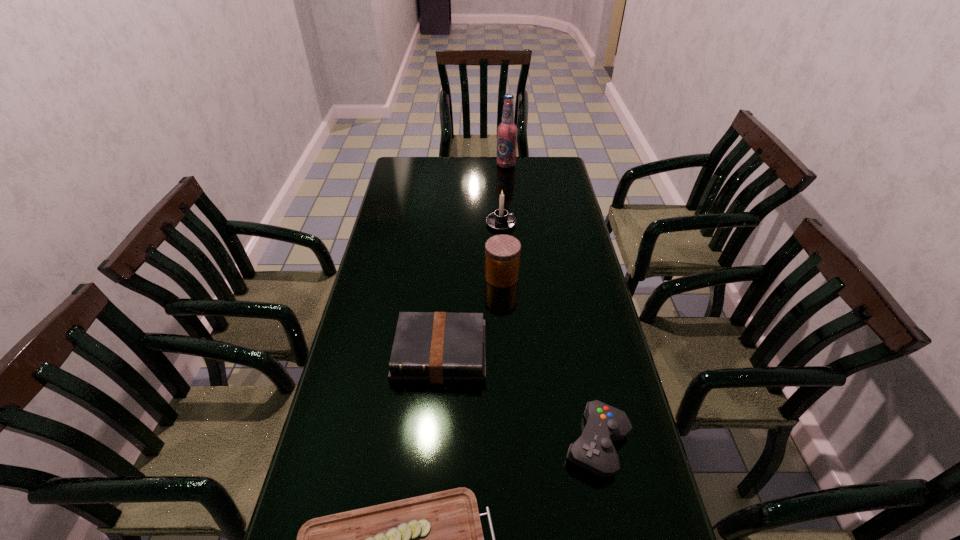
Locate an element on the screen. This screenshot has width=960, height=540. free space between the farthest object and the fourth farthest object is located at coordinates (473, 259).

Where is `free point between the second nearest object and the fourth farthest object`? This screenshot has height=540, width=960. free point between the second nearest object and the fourth farthest object is located at coordinates (518, 399).

Locate an element on the screen. vacant space that is in between the third nearest object and the control is located at coordinates (518, 399).

Locate an element on the screen. The height and width of the screenshot is (540, 960). free spot between the second farthest object and the second nearest object is located at coordinates (549, 333).

The width and height of the screenshot is (960, 540). In order to click on the fourth closest object to the chopping board in this screenshot , I will do `click(501, 220)`.

Find the location of a particular element. This screenshot has width=960, height=540. object that stands as the closest to the rightmost object is located at coordinates (436, 539).

The image size is (960, 540). I want to click on vacant position in the image that satisfies the following two spatial constraints: 1. on the spine side of the fifth farthest object; 2. on the right side of the third nearest object, so coord(433,443).